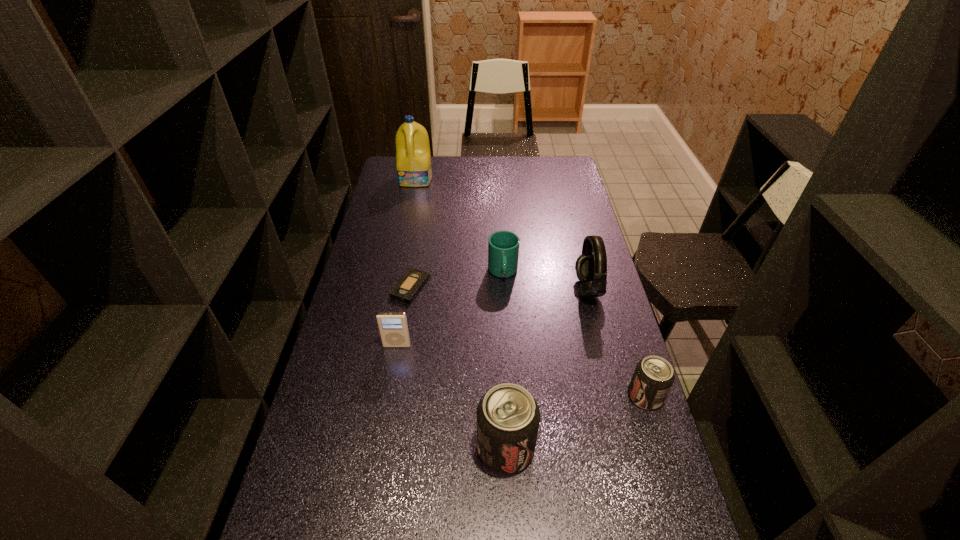
Locate an element on the screen. Image resolution: width=960 pixels, height=540 pixels. empty space that is in between the nearest object and the cup is located at coordinates (504, 360).

Where is `free space between the right soda can and the videotape`? free space between the right soda can and the videotape is located at coordinates (528, 342).

Locate which object ranks fifth in proximity to the cup. Please provide its 2D coordinates. Your answer should be formatted as a tuple, i.e. [(x, y)], where the tuple contains the x and y coordinates of a point satisfying the conditions above.

[(508, 417)]

Identify which object is the third closest to the fifth farthest object. Please provide its 2D coordinates. Your answer should be formatted as a tuple, i.e. [(x, y)], where the tuple contains the x and y coordinates of a point satisfying the conditions above.

[(503, 246)]

Where is `free location that satisfies the following two spatial constraints: 1. on the front-facing side of the iPod; 2. on the left side of the taller soda can`? free location that satisfies the following two spatial constraints: 1. on the front-facing side of the iPod; 2. on the left side of the taller soda can is located at coordinates (379, 448).

The image size is (960, 540). What are the coordinates of `vacant position in the image that satisfies the following two spatial constraints: 1. on the back side of the sixth farthest object; 2. on the right side of the left soda can` in the screenshot? It's located at (503, 396).

Identify the location of vacant point that satisfies the following two spatial constraints: 1. on the earcups of the headset; 2. on the front side of the nearer soda can. Image resolution: width=960 pixels, height=540 pixels. (628, 448).

Locate an element on the screen. free space that satisfies the following two spatial constraints: 1. on the front-facing side of the left soda can; 2. on the left side of the iPod is located at coordinates (379, 448).

Identify the location of free space that satisfies the following two spatial constraints: 1. on the earcups of the headset; 2. on the front-facing side of the iPod. (602, 346).